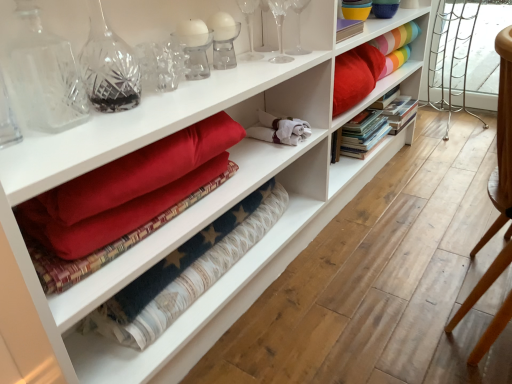
The image size is (512, 384). Describe the element at coordinates (502, 141) in the screenshot. I see `wooden chair at right` at that location.

What do you see at coordinates (362, 133) in the screenshot? The height and width of the screenshot is (384, 512). I see `hardcover books at center` at bounding box center [362, 133].

The image size is (512, 384). What do you see at coordinates (279, 129) in the screenshot? I see `white cotton towels at center` at bounding box center [279, 129].

In order to face transparent glass wine glass at upper center, which is the third glass vase from front to back, should I rotate leftwards or rightwards?

It's best to rotate right around 5.632 degrees.

Describe the element at coordinates (279, 28) in the screenshot. I see `clear crystal glass at upper center, marked as the 2th glass vase in a front-to-back arrangement` at that location.

Find the location of a particular element. clear crystal glass at upper center, which appears as the second glass vase when viewed from the left is located at coordinates (279, 28).

Locate an element on the screen. The image size is (512, 384). wooden chair at right is located at coordinates (502, 141).

Is point (349, 132) behind point (296, 133)?

Yes, point (349, 132) is farther from viewer.

Is hardcover books at center to the left of white cotton towels at center from the viewer's perspective?

No, hardcover books at center is not to the left of white cotton towels at center.

Locate an element on the screen. book above the white cotton towels at center (from the image's perspective) is located at coordinates (362, 133).

Could you tell me if hardcover books at center is turned towards white cotton towels at center?

No, hardcover books at center is not oriented towards white cotton towels at center.

In terms of size, does white textured fabric at center appear bigger or smaller than white cotton towels at center?

white textured fabric at center is bigger than white cotton towels at center.

Is white textured fabric at center outside of white cotton towels at center?

white textured fabric at center is positioned outside white cotton towels at center.

From the image's perspective, is white textured fabric at center on white cotton towels at center?

Actually, white textured fabric at center appears below white cotton towels at center in the image.

Could you tell me if clear crystal glass at upper center, which is the second glass vase in back-to-front order, is facing crystal clear glass vase at upper left, the 1th glass vase positioned from the front?

No, clear crystal glass at upper center, which is the second glass vase in back-to-front order, is not facing towards crystal clear glass vase at upper left, the 1th glass vase positioned from the front.

Is point (279, 3) in front of point (97, 70)?

No, (279, 3) is behind (97, 70).

Considering the relative sizes of clear crystal glass at upper center, marked as the 2th glass vase in a front-to-back arrangement, and crystal clear glass vase at upper left, the 1th glass vase positioned from the front, in the image provided, is clear crystal glass at upper center, marked as the 2th glass vase in a front-to-back arrangement, thinner than crystal clear glass vase at upper left, the 1th glass vase positioned from the front,?

No, clear crystal glass at upper center, marked as the 2th glass vase in a front-to-back arrangement, is not thinner than crystal clear glass vase at upper left, the 1th glass vase positioned from the front.

From their relative heights in the image, would you say clear crystal glass at upper center, which is the second glass vase in back-to-front order, is taller or shorter than crystal clear glass vase at upper left, arranged as the third glass vase when viewed from the back?

Clearly, clear crystal glass at upper center, which is the second glass vase in back-to-front order, is shorter compared to crystal clear glass vase at upper left, arranged as the third glass vase when viewed from the back.

Could you tell me if rainbow striped fabric at upper right is turned towards wooden chair at right?

No, rainbow striped fabric at upper right is not turned towards wooden chair at right.

Where is `fabric that appears behind the wooden chair at right`? The width and height of the screenshot is (512, 384). fabric that appears behind the wooden chair at right is located at coordinates (396, 38).

Is rainbow striped fabric at upper right surrounding wooden chair at right?

No, wooden chair at right is not surrounded by rainbow striped fabric at upper right.

Is point (403, 28) closer or farther from the camera than point (507, 237)?

Clearly, point (403, 28) is more distant from the camera than point (507, 237).

Is white textured fabric at center facing towards rainbow striped fabric at upper right?

No, white textured fabric at center is not turned towards rainbow striped fabric at upper right.

This screenshot has height=384, width=512. In order to click on fabric that is on the right side of white textured fabric at center in this screenshot , I will do `click(396, 38)`.

From a real-world perspective, who is located lower, white textured fabric at center or rainbow striped fabric at upper right?

In real-world perspective, white textured fabric at center is lower.

Considering the relative sizes of white textured fabric at center and rainbow striped fabric at upper right in the image provided, is white textured fabric at center taller than rainbow striped fabric at upper right?

No, white textured fabric at center is not taller than rainbow striped fabric at upper right.

The width and height of the screenshot is (512, 384). Identify the location of glass vase that is the 2nd one when counting upward from the crystal clear glass vase at upper left, which is counted as the 1th glass vase, starting from the left (from the image's perspective). (298, 26).

Between crystal clear glass vase at upper left, the 1th glass vase positioned from the front, and transparent glass wine glass at upper center, which is the third glass vase from front to back, which one has less height?

transparent glass wine glass at upper center, which is the third glass vase from front to back.

Could you tell me if crystal clear glass vase at upper left, arranged as the third glass vase when viewed from the back, is facing transparent glass wine glass at upper center, the third glass vase from the left?

No, crystal clear glass vase at upper left, arranged as the third glass vase when viewed from the back, does not turn towards transparent glass wine glass at upper center, the third glass vase from the left.

Is crystal clear glass vase at upper left, the third glass vase from the right, spatially inside transparent glass wine glass at upper center, the first glass vase in the back-to-front sequence, or outside of it?

The correct answer is: outside.

The image size is (512, 384). Find the location of `book lying above the white cotton towels at center (from the image's perspective)`. book lying above the white cotton towels at center (from the image's perspective) is located at coordinates (362, 133).

Can you tell me how much white cotton towels at center and hardcover books at center differ in facing direction?

They differ by 3.68 degrees in their facing directions.

In the scene shown: From the image's perspective, which is below, white cotton towels at center or hardcover books at center?

white cotton towels at center, from the image's perspective.

In the image, is white cotton towels at center on the left side or the right side of hardcover books at center?

In the image, white cotton towels at center appears on the left side of hardcover books at center.

Where is `clothing located in front of the hardcover books at center`? Image resolution: width=512 pixels, height=384 pixels. clothing located in front of the hardcover books at center is located at coordinates (279, 129).

Where is `clothing above the white textured fabric at center (from a real-world perspective)`? Image resolution: width=512 pixels, height=384 pixels. clothing above the white textured fabric at center (from a real-world perspective) is located at coordinates (279, 129).

When comparing their distances from crystal clear glass vase at upper left, arranged as the third glass vase when viewed from the back, does rainbow striped fabric at upper right or hardcover books at center seem closer?

hardcover books at center.

Looking at this image, when comparing their distances from hardcover books at center, does transparent glass wine glass at upper center, the 1th glass vase when ordered from right to left, or white textured fabric at center seem further?

white textured fabric at center lies further to hardcover books at center than the other object.

Based on their spatial positions, is clear crystal glass at upper center, marked as the 2th glass vase in a front-to-back arrangement, or hardcover books at center closer to crystal clear glass vase at upper left, arranged as the third glass vase when viewed from the back?

clear crystal glass at upper center, marked as the 2th glass vase in a front-to-back arrangement.

Considering their positions, is white cotton towels at center positioned closer to clear crystal glass at upper center, marked as the 2th glass vase in a front-to-back arrangement, than wooden chair at right?

white cotton towels at center is closer to clear crystal glass at upper center, marked as the 2th glass vase in a front-to-back arrangement.

Considering their positions, is clear crystal glass at upper center, marked as the 2th glass vase in a front-to-back arrangement, positioned further to hardcover books at center than white cotton towels at center?

Based on the image, clear crystal glass at upper center, marked as the 2th glass vase in a front-to-back arrangement, appears to be further to hardcover books at center.

Considering their positions, is hardcover books at center positioned further to clear crystal glass at upper center, which is the second glass vase in back-to-front order, than white cotton towels at center?

The object further to clear crystal glass at upper center, which is the second glass vase in back-to-front order, is hardcover books at center.

Based on their spatial positions, is hardcover books at center or clear crystal glass at upper center, which appears as the second glass vase when viewed from the left, further from white cotton towels at center?

hardcover books at center lies further to white cotton towels at center than the other object.

Considering their positions, is rainbow striped fabric at upper right positioned closer to clear crystal glass at upper center, which is the second glass vase in back-to-front order, than wooden chair at right?

Based on the image, rainbow striped fabric at upper right appears to be nearer to clear crystal glass at upper center, which is the second glass vase in back-to-front order.

Where is `clothing between crystal clear glass vase at upper left, the 1th glass vase positioned from the front, and white textured fabric at center vertically`? clothing between crystal clear glass vase at upper left, the 1th glass vase positioned from the front, and white textured fabric at center vertically is located at coordinates (279, 129).

You are a GUI agent. You are given a task and a screenshot of the screen. Output one action in this format:
    pyautogui.click(x=<x>, y=<y>)
    Task: Click on the fabric between white cotton towels at center and hardcover books at center along the z-axis
    Image resolution: width=512 pixels, height=384 pixels.
    Given the screenshot: What is the action you would take?
    pyautogui.click(x=396, y=38)

What are the coordinates of `fabric between clear crystal glass at upper center, marked as the 2th glass vase in a front-to-back arrangement, and hardcover books at center from front to back` in the screenshot? It's located at (396, 38).

Where is `clothing located between wooden chair at right and hardcover books at center in the depth direction`? clothing located between wooden chair at right and hardcover books at center in the depth direction is located at coordinates (279, 129).